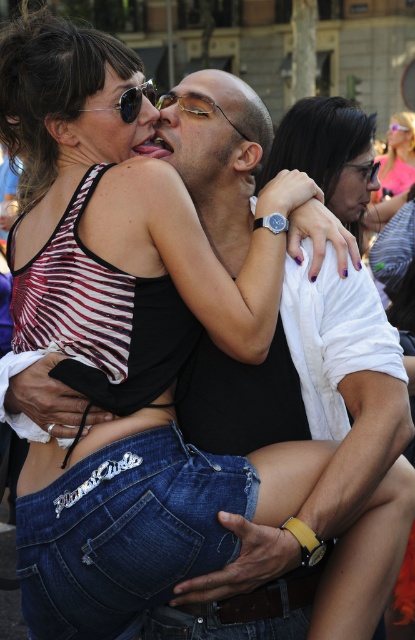
Question: Is matte black sunglasses at upper left smaller than matte black glasses at upper center?

Choices:
 (A) yes
 (B) no

Answer: (A)

Question: Which of the following is the farthest from the observer?

Choices:
 (A) matte black glasses at upper center
 (B) matte black face at center

Answer: (A)

Question: Which point is farther to the camera?

Choices:
 (A) matte black sunglasses at upper center
 (B) pink matte sunglasses at upper right
 (C) matte black face at center
 (D) matte black sunglasses at upper left

Answer: (A)

Question: Is the position of matte black face at center less distant than that of sunglasses at center?

Choices:
 (A) no
 (B) yes

Answer: (A)

Question: Which point is closer to the camera?

Choices:
 (A) matte black glasses at upper center
 (B) pink matte sunglasses at upper right
 (C) sunglasses at center
 (D) matte black sunglasses at upper left

Answer: (C)

Question: Is matte black sunglasses at upper left above pink matte sunglasses at upper right?

Choices:
 (A) yes
 (B) no

Answer: (B)